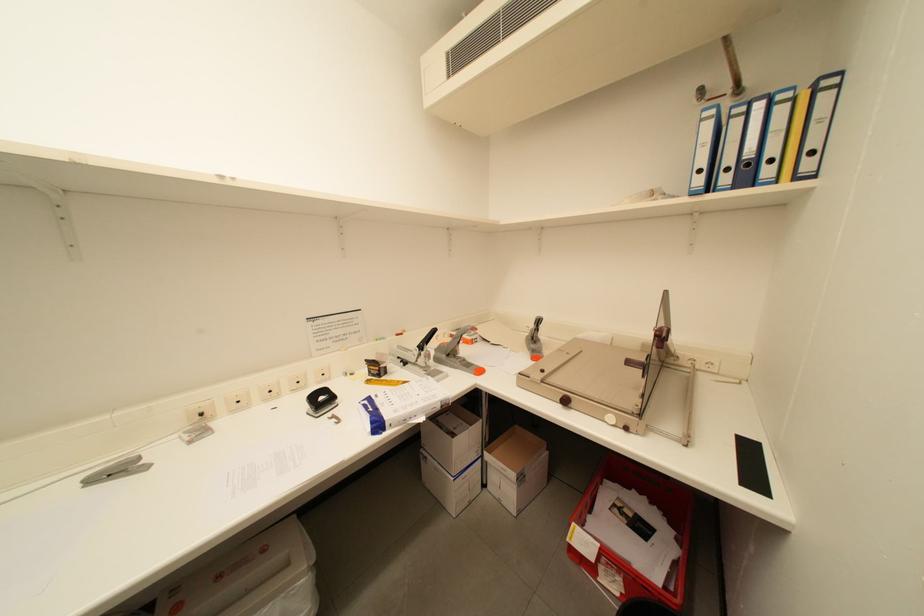
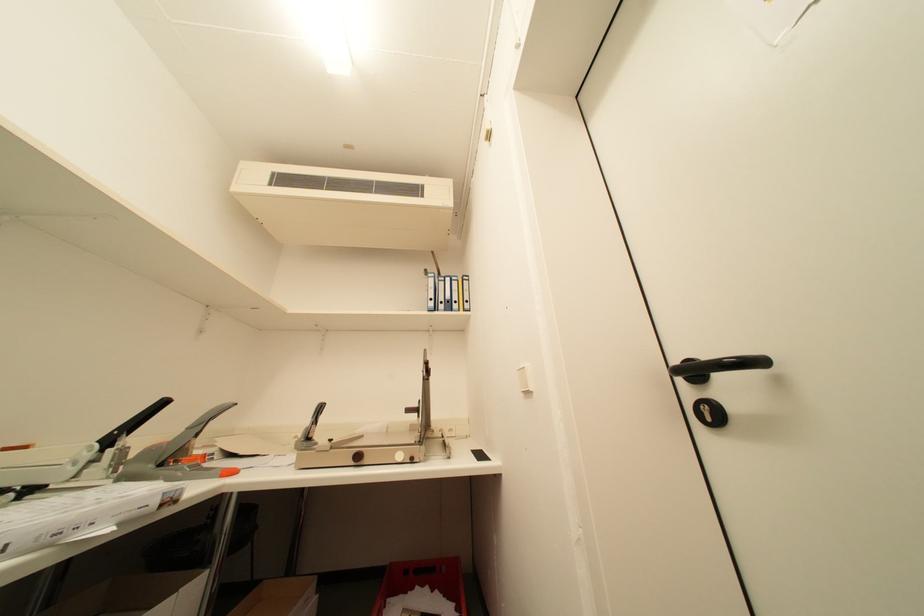
The images are taken continuously from a first-person perspective. In which direction is your viewpoint rotating?

The camera rotated toward right-up.